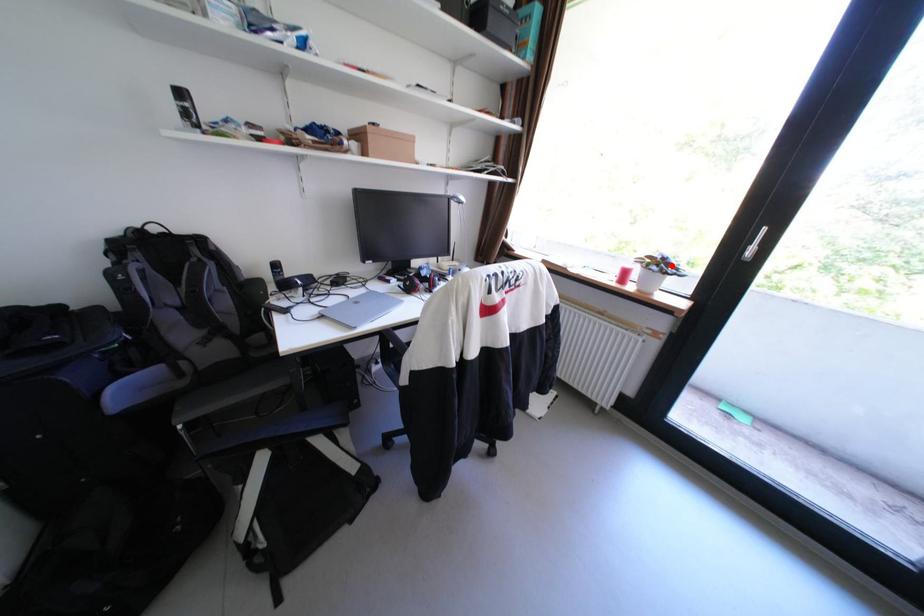
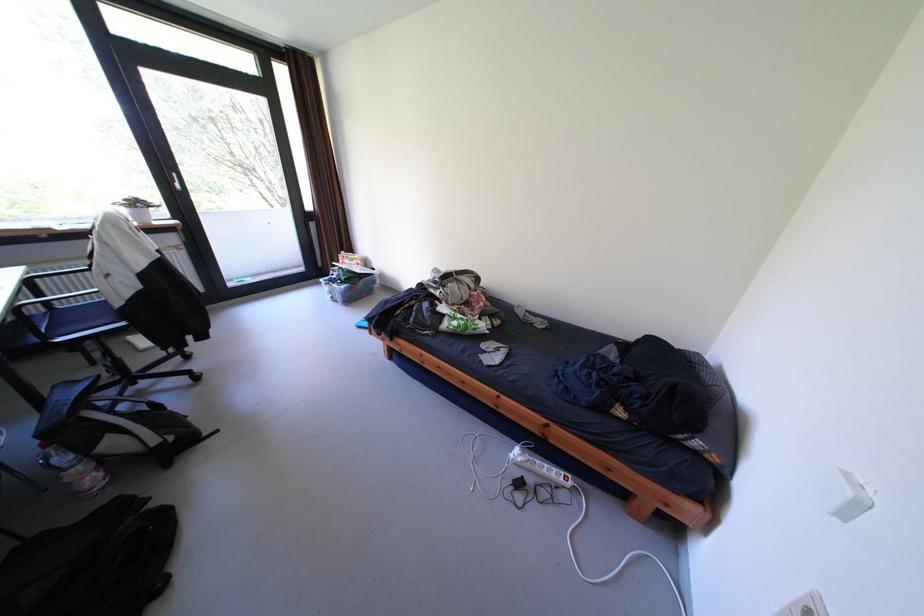
Locate, in the second image, the point that corresponds to the highlighted location in the first image.

(149, 205)